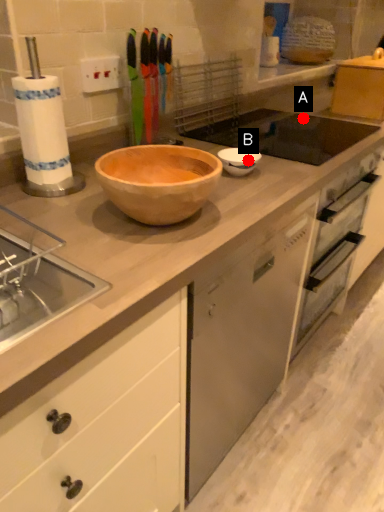
Question: Two points are circled on the image, labeled by A and B beside each circle. Which of the following is the closest to the observer?

Choices:
 (A) A is closer
 (B) B is closer

Answer: (B)